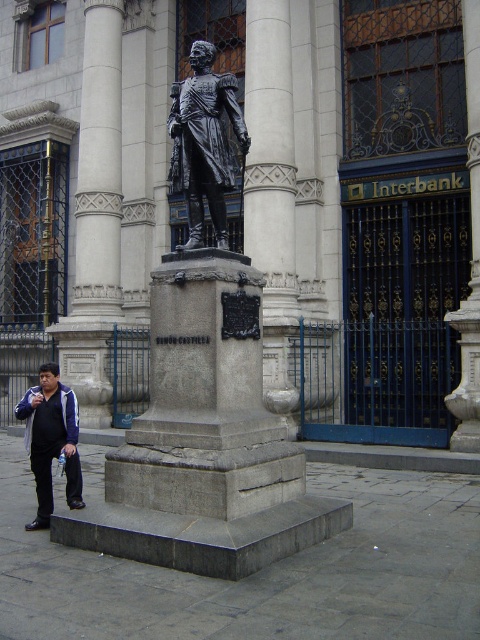
You are a tour guide explaining the layout of the historical site. You mention the black polished statue at center and the gray stone column at center. How far apart are these two landmarks?

The black polished statue at center is 12.63 meters away from the gray stone column at center.

You are standing in front of the grand building and want to take a photo of the black polished statue at center. To ensure the statue is centered in your photo, where should you position yourself relative to the statue?

The black polished statue at center is located at the coordinates 0.537 on the x axis and 0.427 on the y axis, so positioning yourself directly in front of it at those coordinates will ensure it is centered in your photo.